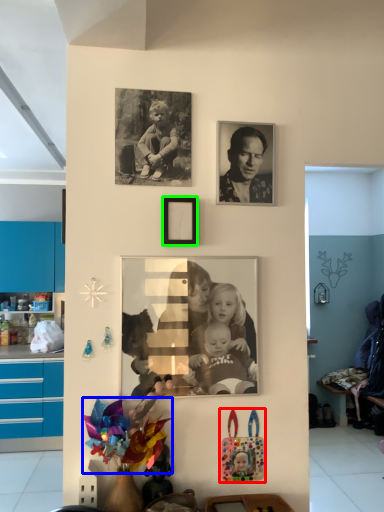
Question: Based on their relative distances, which object is farther from toy (highlighted by a red box)? Choose from flower (highlighted by a blue box) and picture frame (highlighted by a green box).

Choices:
 (A) flower
 (B) picture frame

Answer: (B)